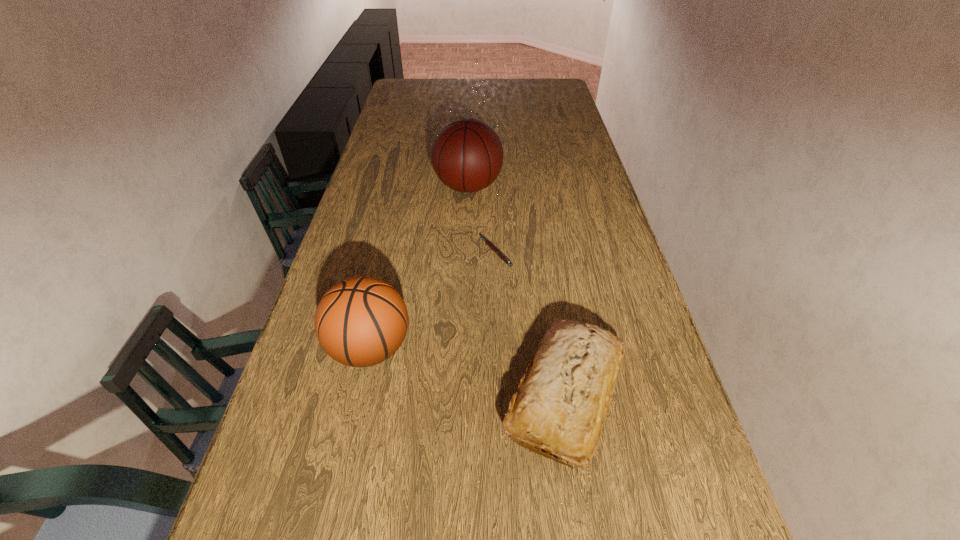
The height and width of the screenshot is (540, 960). Find the location of `the closest object to the bread`. the closest object to the bread is located at coordinates (361, 321).

Where is `the closest object relative to the nearer basketball`? This screenshot has width=960, height=540. the closest object relative to the nearer basketball is located at coordinates (562, 400).

Find the location of a particular element. Image resolution: width=960 pixels, height=540 pixels. vacant position in the image that satisfies the following two spatial constraints: 1. on the back side of the bread; 2. at the nib of the second farthest object is located at coordinates (543, 252).

Image resolution: width=960 pixels, height=540 pixels. I want to click on vacant area that satisfies the following two spatial constraints: 1. at the nib of the third tallest object; 2. on the right side of the pen, so pyautogui.click(x=501, y=395).

Locate an element on the screen. Image resolution: width=960 pixels, height=540 pixels. free space that satisfies the following two spatial constraints: 1. on the front side of the bread; 2. on the right side of the farthest object is located at coordinates (461, 395).